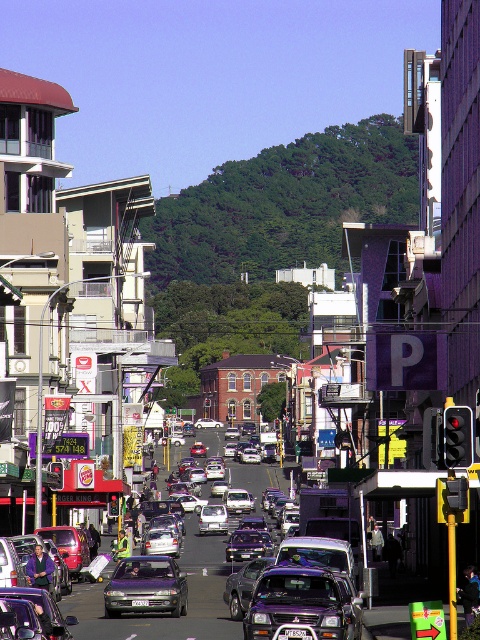
Consider the image. You are standing at the point marked by the coordinate point (247, 545) in the image. Looking around, what type of vehicle are you currently positioned on?

The point (247, 545) marks the metallic purple sedan at center, so you are positioned on the metallic purple sedan at center.

You are a delivery driver trying to navigate through the busy street. You need to deliver a package to a location just past the purple metallic sedan at center. Based on its position, can you estimate how far you need to move forward from your current position at point 0.5, 0.5 to reach the sedan?

The purple metallic sedan at center is located at point (145, 586). To reach it from your current position at (240, 320), you need to move approximately 0.417 units forward in the x direction and approximately 0.196 units backward in the y direction. However, since streets are typically navigated along their length, the primary distance would be the x component, so about 0.417 units forward.

You are a delivery driver who needs to park your car in a parking spot that is exactly the width of the white plastic license plate at center. Can your metallic purple sedan at center fit into this parking spot?

The metallic purple sedan at center is wider than the white plastic license plate at center, so it cannot fit into a parking spot that is exactly the width of the license plate.